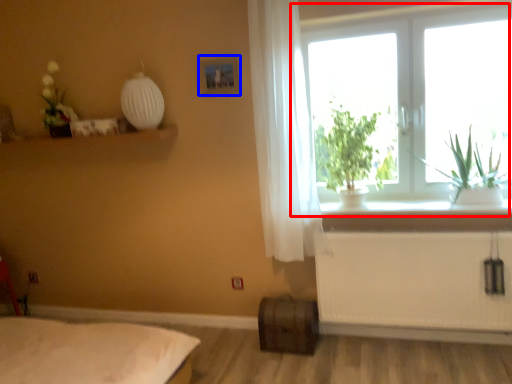
Question: Which of the following is the farthest to the observer, window (highlighted by a red box) or picture frame (highlighted by a blue box)?

Choices:
 (A) window
 (B) picture frame

Answer: (B)